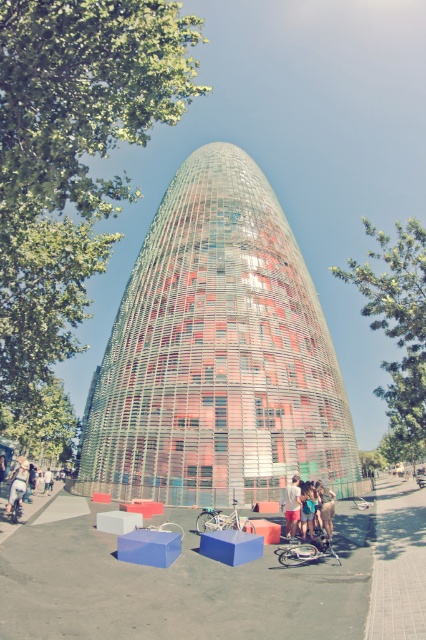
Can you confirm if multicolored glass tower at center is thinner than white cotton shirt at lower center?

In fact, multicolored glass tower at center might be wider than white cotton shirt at lower center.

Who is taller, multicolored glass tower at center or white cotton shirt at lower center?

multicolored glass tower at center is taller.

Locate an element on the screen. This screenshot has width=426, height=640. multicolored glass tower at center is located at coordinates (218, 355).

In the scene shown: Can you confirm if multicolored glass tower at center is positioned to the left of matte pink shorts at lower center?

Correct, you'll find multicolored glass tower at center to the left of matte pink shorts at lower center.

Between point (157, 220) and point (310, 513), which one is positioned in front?

Point (310, 513)

In order to click on multicolored glass tower at center in this screenshot , I will do [x=218, y=355].

Between multicolored glass tower at center and light blue denim shorts at lower left, which one is positioned lower?

light blue denim shorts at lower left is below.

The image size is (426, 640). What do you see at coordinates (218, 355) in the screenshot?
I see `multicolored glass tower at center` at bounding box center [218, 355].

Identify the location of multicolored glass tower at center. The height and width of the screenshot is (640, 426). (218, 355).